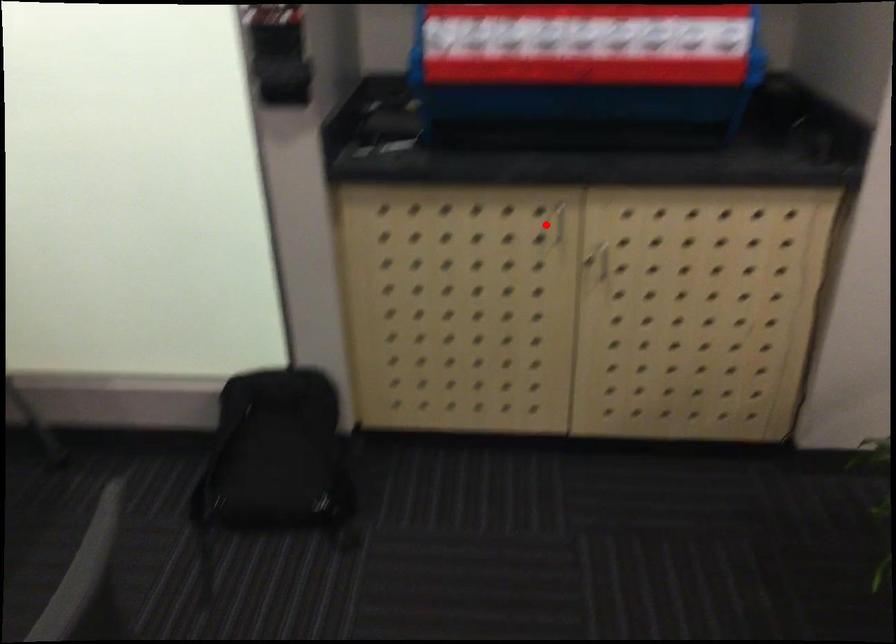
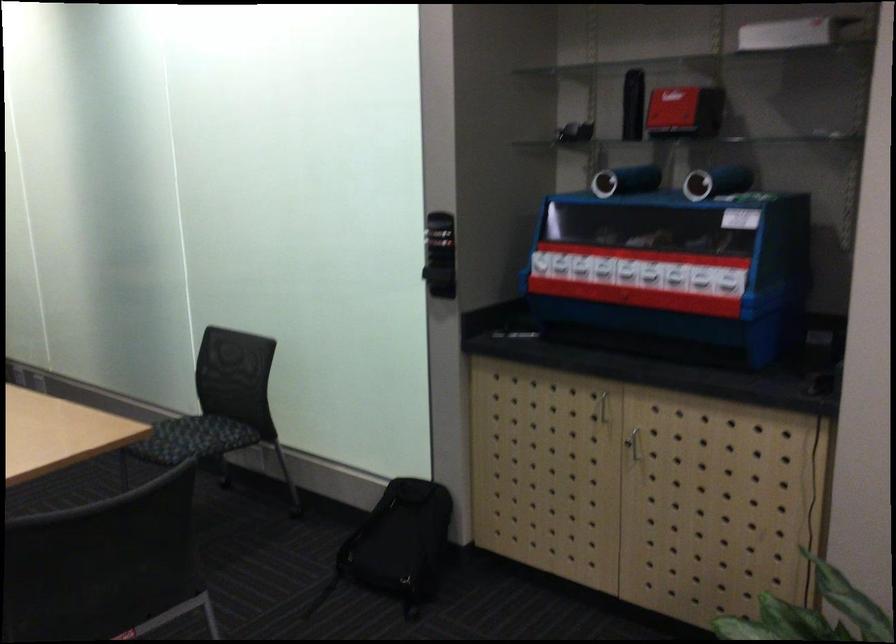
Where in the second image is the point corresponding to the highlighted location from the first image?

(601, 406)